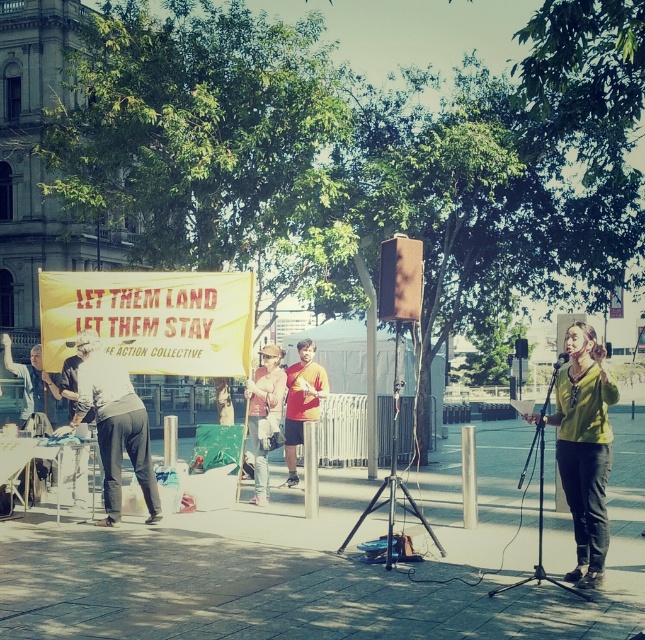
You are a photographer standing in the crowd at the protest. You want to take a photo of the black matte microphone at center and the denim jacket at center. Which object is closer to you?

The denim jacket at center is closer to you because the black matte microphone at center is behind it.

You are a photographer standing at the edge of the crowd, wanting to capture a clear photo of the green matte shirt at center. Where should you aim your camera to ensure the subject is centered in the frame?

You should aim your camera at the coordinates point (582, 448) to center the green matte shirt at center in the frame.